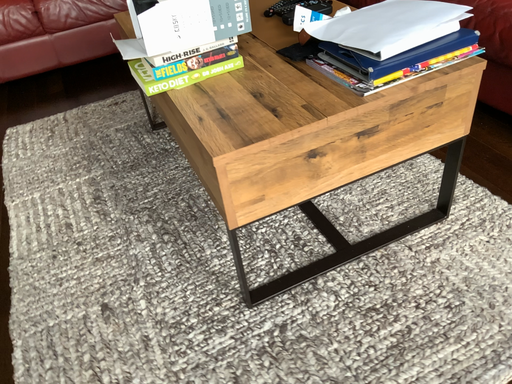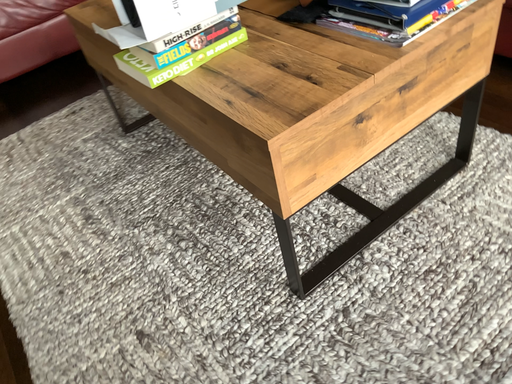
Question: Which way did the camera rotate in the video?

Choices:
 (A) rotated left
 (B) rotated right

Answer: (B)